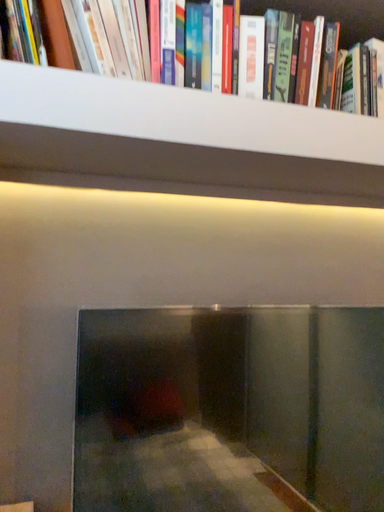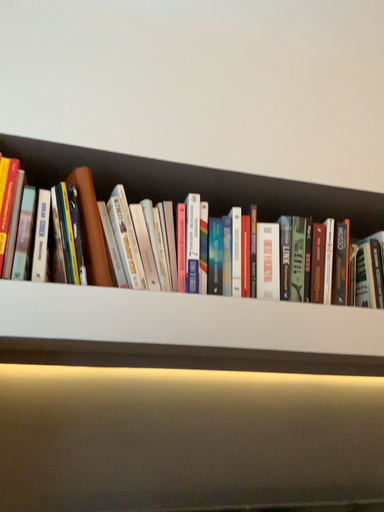
Question: How did the camera likely rotate when shooting the video?

Choices:
 (A) rotated downward
 (B) rotated upward

Answer: (B)